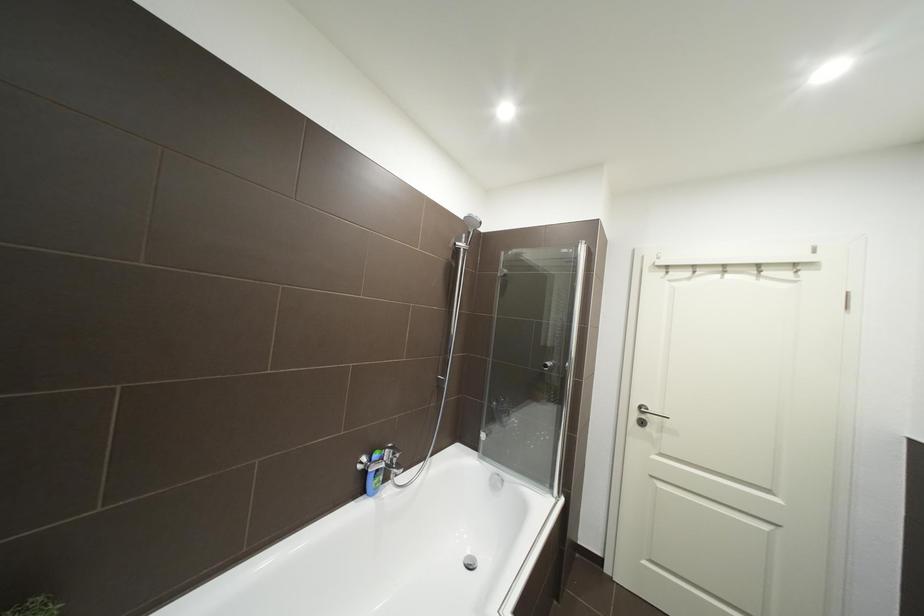
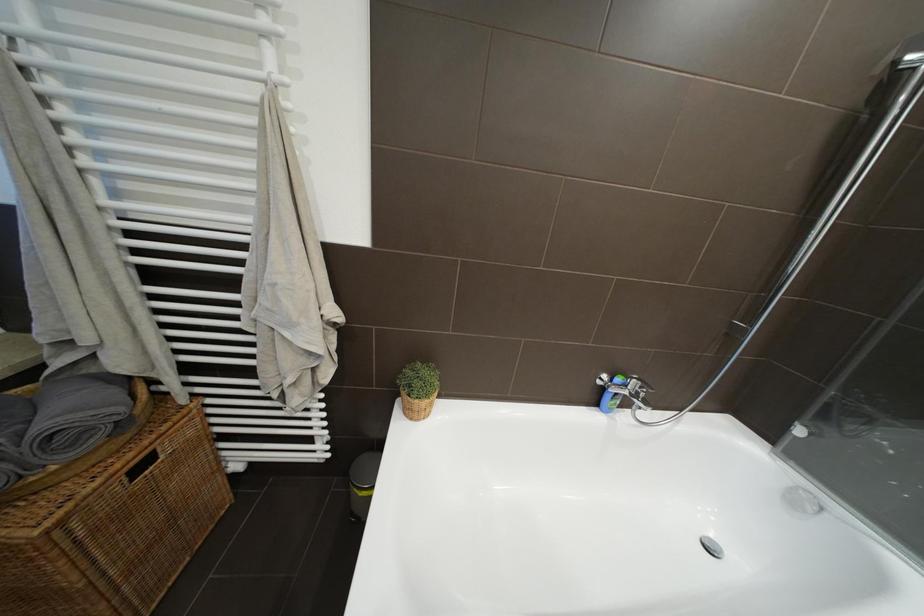
The images are taken continuously from a first-person perspective. In which direction is your viewpoint rotating?

The camera's rotation is toward left-down.